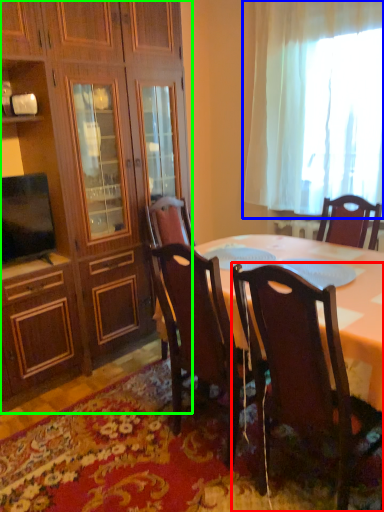
Question: Estimate the real-world distances between objects in this image. Which object is farther from chair (highlighted by a red box), curtain (highlighted by a blue box) or cabinetry (highlighted by a green box)?

Choices:
 (A) curtain
 (B) cabinetry

Answer: (A)